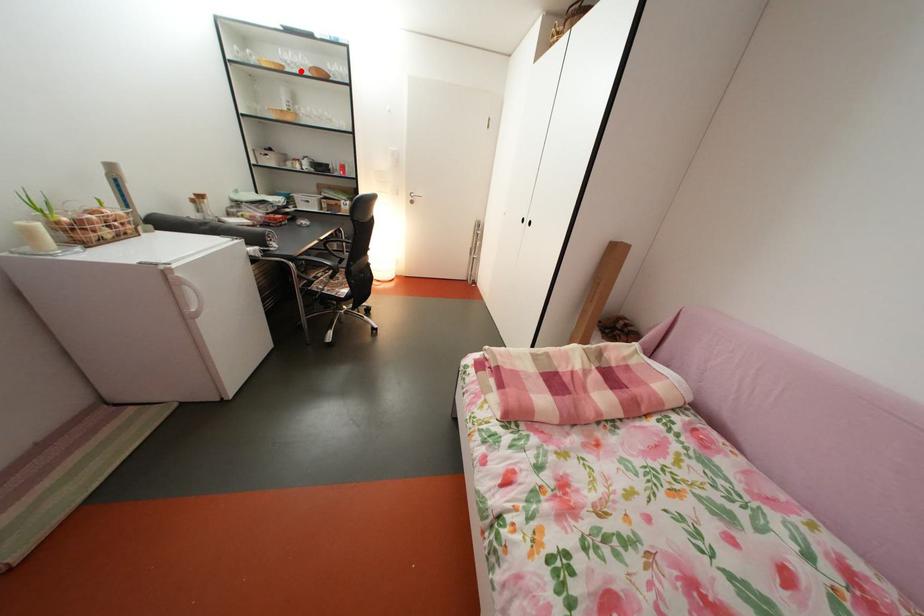
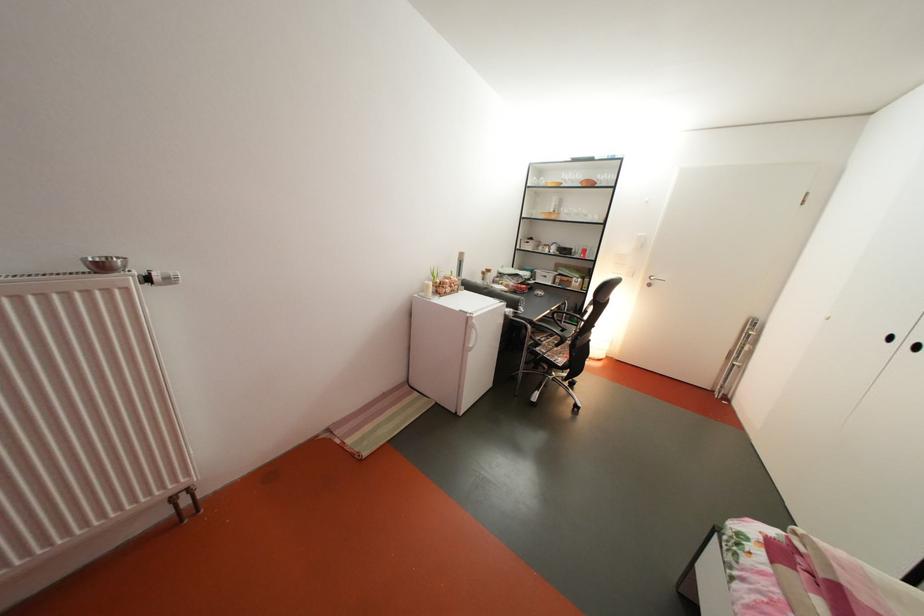
Locate, in the second image, the point that corresponds to the highlighted location in the first image.

(578, 188)